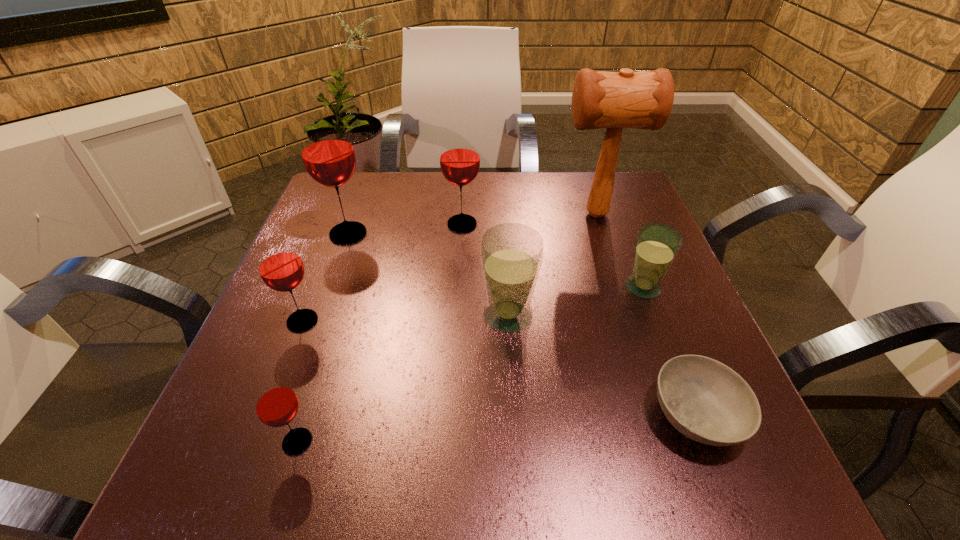
You are a GUI agent. You are given a task and a screenshot of the screen. Output one action in this format:
    pyautogui.click(x=<x>, y=<y>)
    Task: Click on the closest glass to the second smallest red glass
    This screenshot has height=540, width=960.
    Given the screenshot: What is the action you would take?
    coord(276,404)

The width and height of the screenshot is (960, 540). Identify the location of red glass that is the third closest to the tallest object. (279, 264).

You are a GUI agent. You are given a task and a screenshot of the screen. Output one action in this format:
    pyautogui.click(x=<x>, y=<y>)
    Task: Click on the closest red glass to the fifth shortest glass
    This screenshot has width=960, height=540.
    Given the screenshot: What is the action you would take?
    pyautogui.click(x=327, y=151)

Locate an element on the screen. This screenshot has height=540, width=960. free location that satisfies the following two spatial constraints: 1. on the front side of the bowl; 2. on the right side of the biggest red glass is located at coordinates (283, 415).

I want to click on vacant position in the image that satisfies the following two spatial constraints: 1. on the back side of the third biggest red glass; 2. on the right side of the right blue glass, so click(x=316, y=288).

Where is `free location that satisfies the following two spatial constraints: 1. on the front side of the bigger blue glass; 2. on the left side of the third tallest object`? free location that satisfies the following two spatial constraints: 1. on the front side of the bigger blue glass; 2. on the left side of the third tallest object is located at coordinates (458, 315).